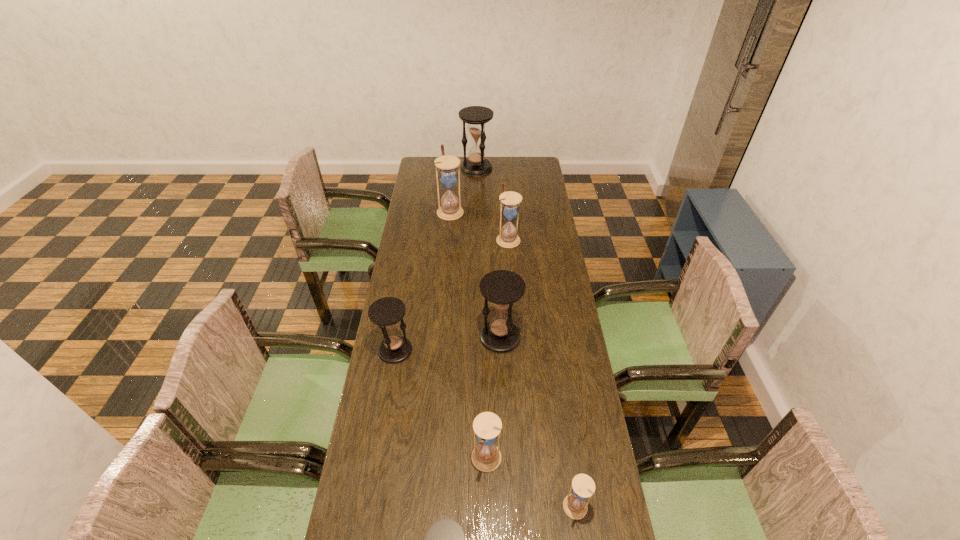
Image resolution: width=960 pixels, height=540 pixels. I want to click on object that is positioned at the far edge, so click(x=476, y=116).

Locate an element on the screen. The width and height of the screenshot is (960, 540). object present at the right edge is located at coordinates (583, 487).

This screenshot has width=960, height=540. Identify the location of free spot at the far edge of the desktop. (501, 162).

Locate an element on the screen. The height and width of the screenshot is (540, 960). vacant area at the left edge of the desktop is located at coordinates click(404, 515).

Where is `free space at the right edge of the desktop`? free space at the right edge of the desktop is located at coordinates (558, 327).

Where is `blank space at the far left corner`? blank space at the far left corner is located at coordinates (434, 176).

At what (x,y) coordinates should I click in order to perform the action: click on free spot at the far right corner of the desktop. Please return your answer as a coordinate pair (x, y). This screenshot has width=960, height=540. Looking at the image, I should click on (518, 167).

Locate an element on the screen. free space between the rightmost hourglass and the farthest hourglass is located at coordinates (526, 338).

What are the coordinates of `free space between the sixth farthest object and the second farthest hourglass` in the screenshot? It's located at (468, 335).

The image size is (960, 540). I want to click on vacant area that lies between the third nearest object and the leftmost hourglass, so click(441, 405).